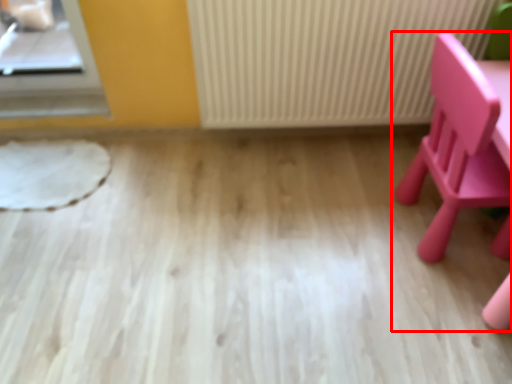
Question: From the image, what is the correct spatial relationship of chair (annotated by the red box) in relation to radiator?

Choices:
 (A) right
 (B) left

Answer: (A)